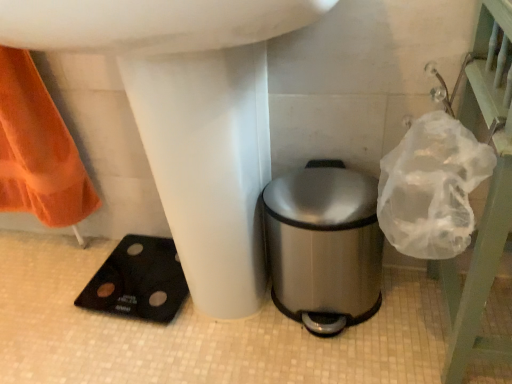
Question: Should I look upward or downward to see clear plastic bag at upper right?

Choices:
 (A) down
 (B) up

Answer: (A)

Question: Is white glossy sink at center outside clear plastic bag at upper right?

Choices:
 (A) yes
 (B) no

Answer: (A)

Question: Considering the relative positions of white glossy sink at center and clear plastic bag at upper right in the image provided, is white glossy sink at center to the right of clear plastic bag at upper right from the viewer's perspective?

Choices:
 (A) no
 (B) yes

Answer: (A)

Question: From the image's perspective, is white glossy sink at center under clear plastic bag at upper right?

Choices:
 (A) no
 (B) yes

Answer: (A)

Question: Is white glossy sink at center closer to the viewer compared to clear plastic bag at upper right?

Choices:
 (A) no
 (B) yes

Answer: (B)

Question: Is white glossy sink at center at the left side of clear plastic bag at upper right?

Choices:
 (A) no
 (B) yes

Answer: (B)

Question: Is white glossy sink at center taller than clear plastic bag at upper right?

Choices:
 (A) no
 (B) yes

Answer: (B)

Question: Is clear plastic bag at upper right facing away from white glossy sink at center?

Choices:
 (A) yes
 (B) no

Answer: (B)

Question: Can you confirm if clear plastic bag at upper right is positioned to the left of white glossy sink at center?

Choices:
 (A) no
 (B) yes

Answer: (A)

Question: From a real-world perspective, is clear plastic bag at upper right over white glossy sink at center?

Choices:
 (A) yes
 (B) no

Answer: (B)

Question: From the image's perspective, is clear plastic bag at upper right on top of white glossy sink at center?

Choices:
 (A) no
 (B) yes

Answer: (A)

Question: From a real-world perspective, is clear plastic bag at upper right positioned under white glossy sink at center based on gravity?

Choices:
 (A) no
 (B) yes

Answer: (B)

Question: Is clear plastic bag at upper right next to white glossy sink at center and touching it?

Choices:
 (A) no
 (B) yes

Answer: (A)

Question: Is stainless steel trash can at lower right positioned in front of clear plastic bag at upper right?

Choices:
 (A) yes
 (B) no

Answer: (B)